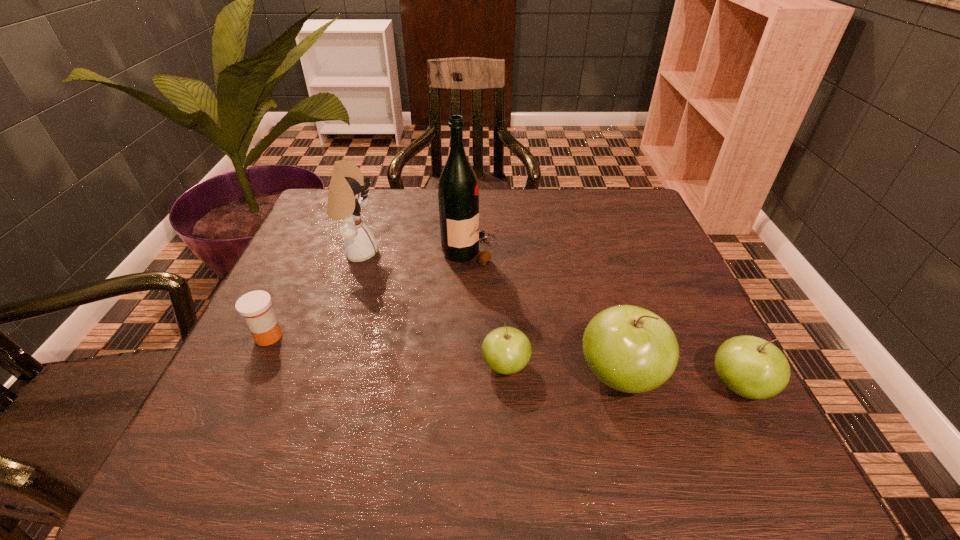
Identify the location of vacant space that is in between the leftmost object and the leftmost apple. (387, 351).

At what (x,y) coordinates should I click in order to perform the action: click on vacant area that lies between the leftmost object and the leftmost apple. Please return your answer as a coordinate pair (x, y). This screenshot has height=540, width=960. Looking at the image, I should click on (387, 351).

Image resolution: width=960 pixels, height=540 pixels. Find the location of `free space between the fourth shortest object and the medicine`. free space between the fourth shortest object and the medicine is located at coordinates (444, 356).

You are a GUI agent. You are given a task and a screenshot of the screen. Output one action in this format:
    pyautogui.click(x=<x>, y=<y>)
    Task: Click on the free spot between the shortest apple and the tallest apple
    This screenshot has height=540, width=960.
    Given the screenshot: What is the action you would take?
    pyautogui.click(x=563, y=371)

You are a GUI agent. You are given a task and a screenshot of the screen. Output one action in this format:
    pyautogui.click(x=<x>, y=<y>)
    Task: Click on the vacant region between the wine bottle and the medicine
    
    Given the screenshot: What is the action you would take?
    pyautogui.click(x=369, y=294)

In order to click on the fourth closest object to the leftmost apple in this screenshot , I will do `click(347, 195)`.

Locate an element on the screen. object that can be found as the fourth closest to the rightmost object is located at coordinates (347, 195).

Identify which apple is the second closest to the doll. Please provide its 2D coordinates. Your answer should be formatted as a tuple, i.e. [(x, y)], where the tuple contains the x and y coordinates of a point satisfying the conditions above.

[(630, 349)]

Identify the location of apple that is the closest one to the tallest apple. (751, 367).

Locate an element on the screen. vacant space that satisfies the following two spatial constraints: 1. on the surface of the tallest object; 2. on the left side of the second tallest apple is located at coordinates (465, 387).